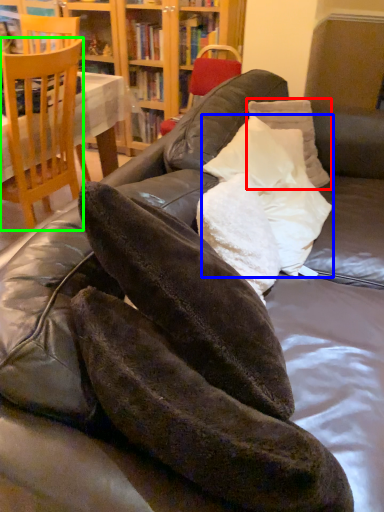
Question: Estimate the real-world distances between objects in this image. Which object is closer to pillow (highlighted by a red box), pillow (highlighted by a blue box) or chair (highlighted by a green box)?

Choices:
 (A) pillow
 (B) chair

Answer: (A)